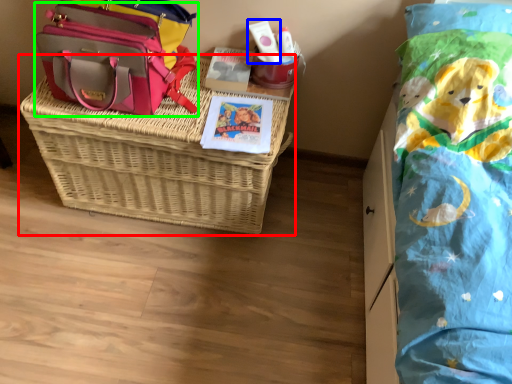
Question: Considering the real-world distances, which object is closest to picnic basket (highlighted by a red box)? toiletry (highlighted by a blue box) or shoulder bag (highlighted by a green box).

Choices:
 (A) toiletry
 (B) shoulder bag

Answer: (B)